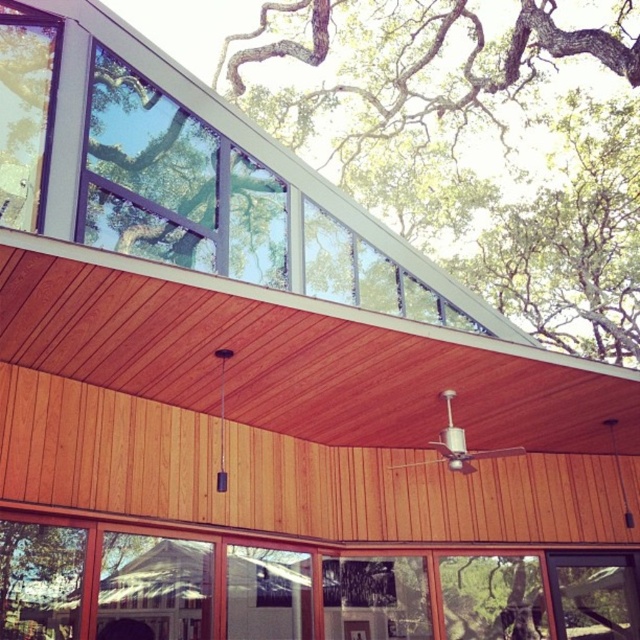
Question: Is clear glass windows at upper center in front of clear glass window at center?

Choices:
 (A) yes
 (B) no

Answer: (A)

Question: Which point is closer to the camera taking this photo?

Choices:
 (A) (136, 54)
 (B) (611, 51)
 (C) (589, 570)

Answer: (A)

Question: Estimate the real-world distances between objects in this image. Which object is farther from the clear glass window at center?

Choices:
 (A) clear glass windows at upper center
 (B) green leafy tree at upper center

Answer: (B)

Question: Which object appears farthest from the camera in this image?

Choices:
 (A) green leafy tree at upper center
 (B) clear glass window at center

Answer: (A)

Question: Does green leafy tree at upper center have a greater width compared to clear glass windows at upper center?

Choices:
 (A) yes
 (B) no

Answer: (A)

Question: Does clear glass windows at upper center appear on the left side of clear glass window at center?

Choices:
 (A) no
 (B) yes

Answer: (B)